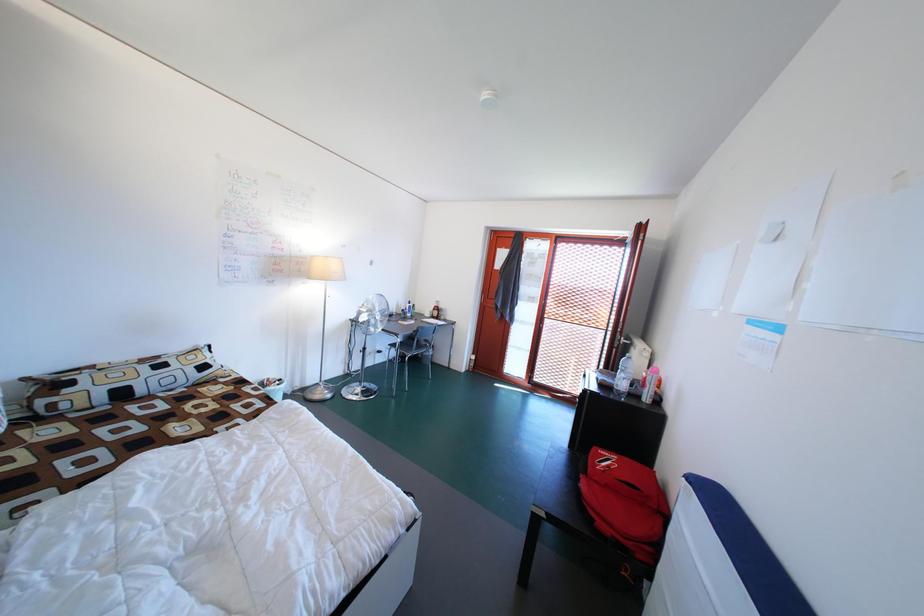
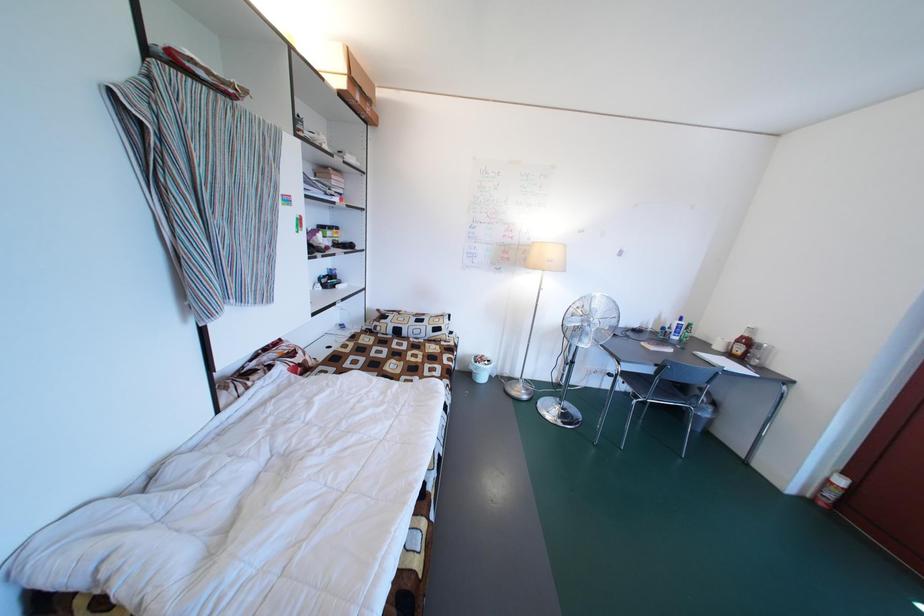
Question: Based on the continuous images, in which direction is the camera rotating? Reply with the corresponding letter.

Choices:
 (A) Left
 (B) Right
 (C) Up
 (D) Down

Answer: (A)